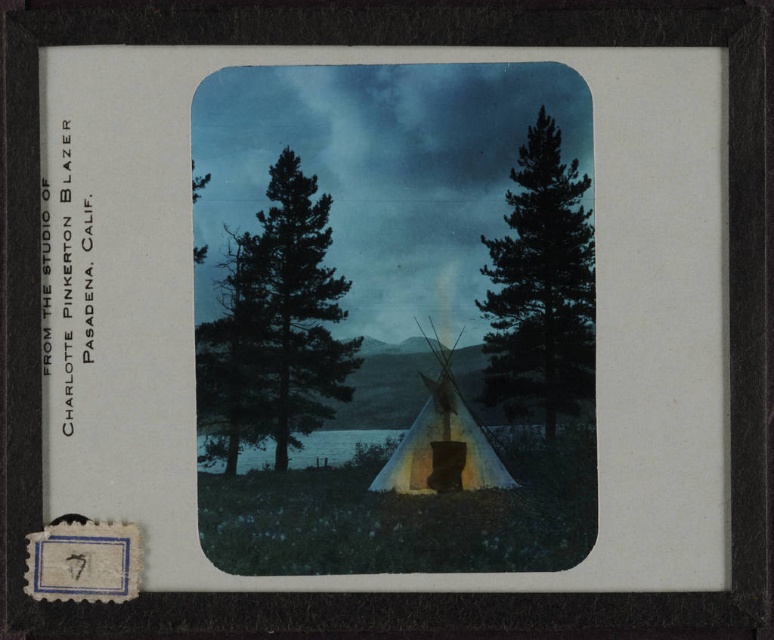
Is green matte tree at center smaller than blue water at center?

Incorrect, green matte tree at center is not smaller in size than blue water at center.

Can you confirm if green matte tree at center is wider than blue water at center?

No, green matte tree at center is not wider than blue water at center.

Measure the distance between point (278, 442) and camera.

The distance of point (278, 442) from camera is 38.11 inches.

Locate an element on the screen. green matte tree at center is located at coordinates (274, 326).

Does white canvas tent at center appear on the left side of blue water at center?

Incorrect, white canvas tent at center is not on the left side of blue water at center.

From the picture: Which is more to the right, white canvas tent at center or blue water at center?

Positioned to the right is white canvas tent at center.

What do you see at coordinates (442, 440) in the screenshot? The width and height of the screenshot is (774, 640). I see `white canvas tent at center` at bounding box center [442, 440].

The height and width of the screenshot is (640, 774). I want to click on white canvas tent at center, so click(442, 440).

Can you confirm if green matte tree at right is smaller than blue water at center?

No, green matte tree at right is not smaller than blue water at center.

Who is lower down, green matte tree at right or blue water at center?

Positioned lower is blue water at center.

The width and height of the screenshot is (774, 640). What do you see at coordinates (540, 288) in the screenshot? I see `green matte tree at right` at bounding box center [540, 288].

Find the location of `green matte tree at right`. green matte tree at right is located at coordinates (540, 288).